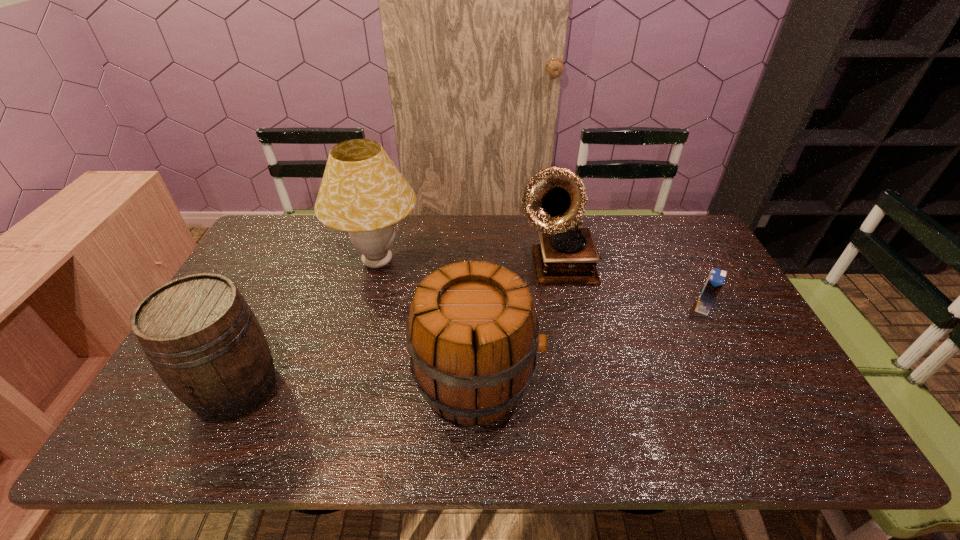
Identify the location of free space between the left cider and the lampshade. (307, 325).

Find the location of a particular element. unoccupied area between the record player and the shortest object is located at coordinates (631, 288).

This screenshot has width=960, height=540. In order to click on vacant region between the record player and the orange_juice in this screenshot , I will do `click(631, 288)`.

Locate an element on the screen. Image resolution: width=960 pixels, height=540 pixels. free spot between the right cider and the rightmost object is located at coordinates (x=590, y=344).

At what (x,y) coordinates should I click in order to perform the action: click on object that is the fourth closest to the third nearest object. Please return your answer as a coordinate pair (x, y). Looking at the image, I should click on (200, 335).

Where is `object that stands as the closest to the left cider`? The width and height of the screenshot is (960, 540). object that stands as the closest to the left cider is located at coordinates (362, 192).

Identify the location of free space in the image that satisfies the following two spatial constraints: 1. on the front side of the third nearest object; 2. on the side of the right cider where the spigot is located. The height and width of the screenshot is (540, 960). tap(742, 381).

Locate an element on the screen. This screenshot has height=540, width=960. blank area in the image that satisfies the following two spatial constraints: 1. on the horn of the record player; 2. on the left side of the shortest object is located at coordinates (566, 307).

At what (x,y) coordinates should I click in order to perform the action: click on free location that satisfies the following two spatial constraints: 1. on the horn of the record player; 2. on the left side of the third nearest object. Please return your answer as a coordinate pair (x, y). Looking at the image, I should click on (566, 307).